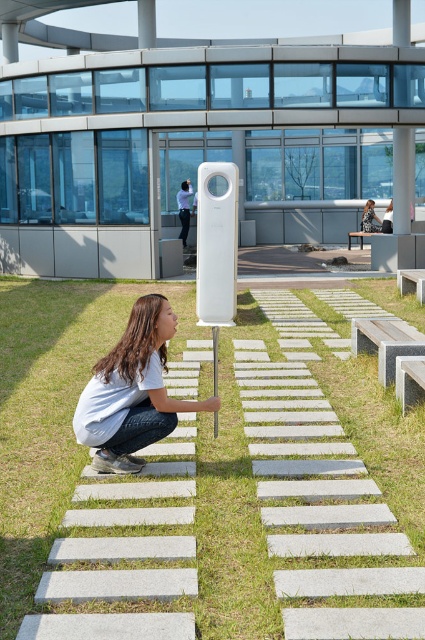
You are a photographer trying to capture a photo of the white matte girl at center and the white wooden bench at center from a distance. Which object will appear taller in the photo?

The white matte girl at center will appear taller in the photo since she has a greater height compared to the white wooden bench at center.

Based on the photo, you are standing in front of the modern architectural structure and want to take a photo that includes both the young woman and the tall rectangular object with a circular cutout. Which point, point (163,595) or point (404,147), is closer to you?

Point (163,595) is closer to the viewer than point (404,147), so you should position yourself to include that point first in your photo.

You are standing in the outdoor area and want to place your matte white phone at center on the white wooden bench at center. Which side of the bench should you place it on?

The matte white phone at center is positioned on the right side of white wooden bench at center, so you should place it on the right side of the bench.